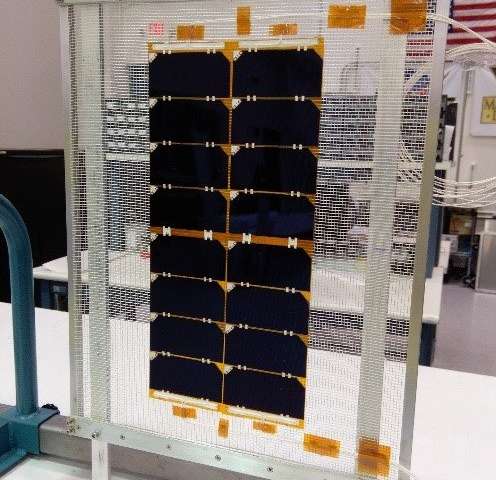
At what (x,y) coordinates should I click in order to perform the action: click on papers. Please return your answer as a coordinate pair (x, y). Looking at the image, I should click on (56, 261).